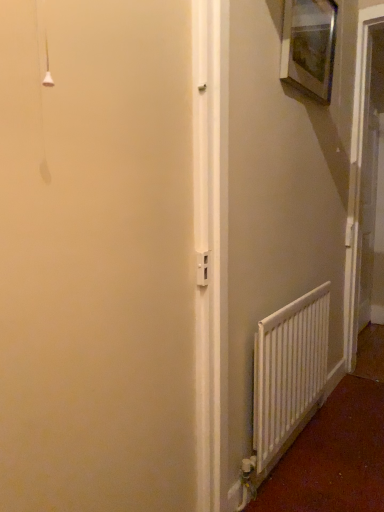
Question: Is white plastic screen door at right facing away from white matte radiator at lower right?

Choices:
 (A) yes
 (B) no

Answer: (B)

Question: Would you say white plastic screen door at right is outside white matte radiator at lower right?

Choices:
 (A) yes
 (B) no

Answer: (A)

Question: From the image's perspective, is white plastic screen door at right below white matte radiator at lower right?

Choices:
 (A) yes
 (B) no

Answer: (B)

Question: Is white plastic screen door at right facing towards white matte radiator at lower right?

Choices:
 (A) no
 (B) yes

Answer: (A)

Question: From a real-world perspective, is white plastic screen door at right below white matte radiator at lower right?

Choices:
 (A) no
 (B) yes

Answer: (A)

Question: Does white plastic screen door at right have a lesser width compared to white matte radiator at lower right?

Choices:
 (A) yes
 (B) no

Answer: (B)

Question: Considering the relative positions of wooden picture frame at upper right and white matte radiator at lower right in the image provided, is wooden picture frame at upper right to the left of white matte radiator at lower right from the viewer's perspective?

Choices:
 (A) no
 (B) yes

Answer: (A)

Question: From the image's perspective, is wooden picture frame at upper right located above white matte radiator at lower right?

Choices:
 (A) yes
 (B) no

Answer: (A)

Question: Is wooden picture frame at upper right taller than white matte radiator at lower right?

Choices:
 (A) yes
 (B) no

Answer: (B)

Question: Does wooden picture frame at upper right have a lesser width compared to white matte radiator at lower right?

Choices:
 (A) yes
 (B) no

Answer: (A)

Question: From the image's perspective, is wooden picture frame at upper right below white matte radiator at lower right?

Choices:
 (A) no
 (B) yes

Answer: (A)

Question: Is wooden picture frame at upper right at the right side of white matte radiator at lower right?

Choices:
 (A) yes
 (B) no

Answer: (A)

Question: Would you say white plastic screen door at right is a long distance from wooden picture frame at upper right?

Choices:
 (A) yes
 (B) no

Answer: (B)